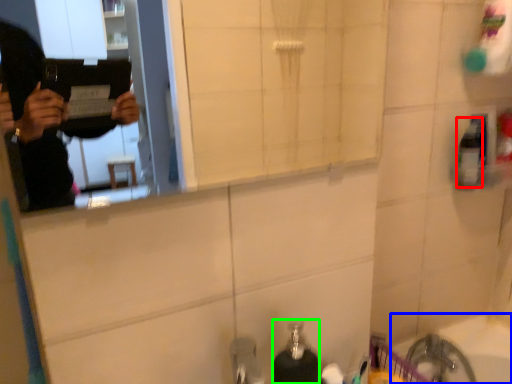
Question: Which is farther away from mouthwash (highlighted by a red box)? bath (highlighted by a blue box) or soap dispenser (highlighted by a green box)?

Choices:
 (A) bath
 (B) soap dispenser

Answer: (B)